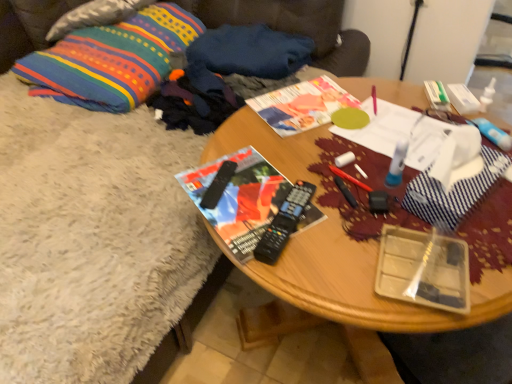
Find the location of a particular element. This screenshot has width=512, height=384. blank space situated above wooden table at center (from a real-world perspective) is located at coordinates (350, 161).